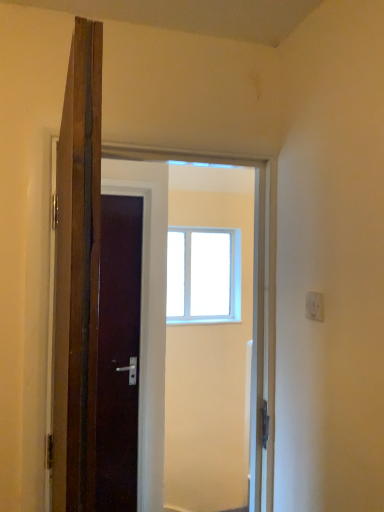
In the scene shown: Measure the distance between point (203, 268) and camera.

The distance of point (203, 268) from camera is 13.84 feet.

The image size is (384, 512). Describe the element at coordinates (203, 275) in the screenshot. I see `transparent glass window at center` at that location.

Locate an element on the screen. Image resolution: width=384 pixels, height=512 pixels. transparent glass window at center is located at coordinates (203, 275).

Where is `white plastic electric outlet at upper right`? This screenshot has width=384, height=512. white plastic electric outlet at upper right is located at coordinates (314, 306).

Measure the distance between white plastic electric outlet at upper right and camera.

white plastic electric outlet at upper right and camera are 4.27 feet apart from each other.

The height and width of the screenshot is (512, 384). What do you see at coordinates (314, 306) in the screenshot?
I see `white plastic electric outlet at upper right` at bounding box center [314, 306].

At what (x,y) coordinates should I click in order to perform the action: click on transparent glass window at center. Please return your answer as a coordinate pair (x, y). The width and height of the screenshot is (384, 512). Looking at the image, I should click on (203, 275).

Is white plastic electric outlet at upper right at the left side of transparent glass window at center?

No, white plastic electric outlet at upper right is not to the left of transparent glass window at center.

Based on the photo, considering the positions of objects white plastic electric outlet at upper right and transparent glass window at center in the image provided, who is behind, white plastic electric outlet at upper right or transparent glass window at center?

transparent glass window at center is further away from the camera.

Which point is more distant from viewer, (306,297) or (236,263)?

The point (236,263) is farther.

From the image's perspective, which is above, white plastic electric outlet at upper right or transparent glass window at center?

white plastic electric outlet at upper right, from the image's perspective.

From a real-world perspective, relative to transparent glass window at center, is white plastic electric outlet at upper right vertically above or below?

white plastic electric outlet at upper right is situated lower than transparent glass window at center in the real world.

Consider the image. Which of these two, white plastic electric outlet at upper right or transparent glass window at center, is wider?

With larger width is transparent glass window at center.

In terms of height, does white plastic electric outlet at upper right look taller or shorter compared to transparent glass window at center?

In the image, white plastic electric outlet at upper right appears to be shorter than transparent glass window at center.

Can you confirm if white plastic electric outlet at upper right is smaller than transparent glass window at center?

Yes.

Is white plastic electric outlet at upper right not inside transparent glass window at center?

Indeed, white plastic electric outlet at upper right is completely outside transparent glass window at center.

Is white plastic electric outlet at upper right in contact with transparent glass window at center?

There is a gap between white plastic electric outlet at upper right and transparent glass window at center.

Is transparent glass window at center at the back of white plastic electric outlet at upper right?

white plastic electric outlet at upper right is not turned away from transparent glass window at center.

Identify the location of electric outlet located in front of the transparent glass window at center. (314, 306).

Considering the positions of objects transparent glass window at center and white plastic electric outlet at upper right in the image provided, who is more to the right, transparent glass window at center or white plastic electric outlet at upper right?

From the viewer's perspective, white plastic electric outlet at upper right appears more on the right side.

Which object is further away from the camera taking this photo, transparent glass window at center or white plastic electric outlet at upper right?

transparent glass window at center is more distant.

Which is in front, point (229, 283) or point (306, 298)?

The point (306, 298) is closer to the camera.

From the image's perspective, relative to white plastic electric outlet at upper right, is transparent glass window at center above or below?

Based on their image positions, transparent glass window at center is located beneath white plastic electric outlet at upper right.

From a real-world perspective, is transparent glass window at center physically below white plastic electric outlet at upper right?

Actually, transparent glass window at center is physically above white plastic electric outlet at upper right in the real world.

Considering the relative sizes of transparent glass window at center and white plastic electric outlet at upper right in the image provided, is transparent glass window at center wider than white plastic electric outlet at upper right?

Yes, transparent glass window at center is wider than white plastic electric outlet at upper right.

Can you confirm if transparent glass window at center is taller than white plastic electric outlet at upper right?

Indeed, transparent glass window at center has a greater height compared to white plastic electric outlet at upper right.

Is transparent glass window at center bigger or smaller than white plastic electric outlet at upper right?

In the image, transparent glass window at center appears to be larger than white plastic electric outlet at upper right.

Do you think transparent glass window at center is within white plastic electric outlet at upper right, or outside of it?

transparent glass window at center cannot be found inside white plastic electric outlet at upper right.

Are transparent glass window at center and white plastic electric outlet at upper right far apart?

Absolutely, transparent glass window at center is distant from white plastic electric outlet at upper right.

Could you tell me if transparent glass window at center is turned towards white plastic electric outlet at upper right?

Yes, transparent glass window at center is facing white plastic electric outlet at upper right.

How much distance is there between transparent glass window at center and white plastic electric outlet at upper right?

They are 9.45 feet apart.

You are a GUI agent. You are given a task and a screenshot of the screen. Output one action in this format:
    pyautogui.click(x=<x>, y=<y>)
    Task: Click on the window that is behind the white plastic electric outlet at upper right
    This screenshot has height=512, width=384.
    Given the screenshot: What is the action you would take?
    pyautogui.click(x=203, y=275)

The image size is (384, 512). What are the coordinates of `electric outlet that is on the right side of transparent glass window at center` in the screenshot? It's located at 314,306.

Locate an element on the screen. This screenshot has width=384, height=512. electric outlet in front of the transparent glass window at center is located at coordinates (314, 306).